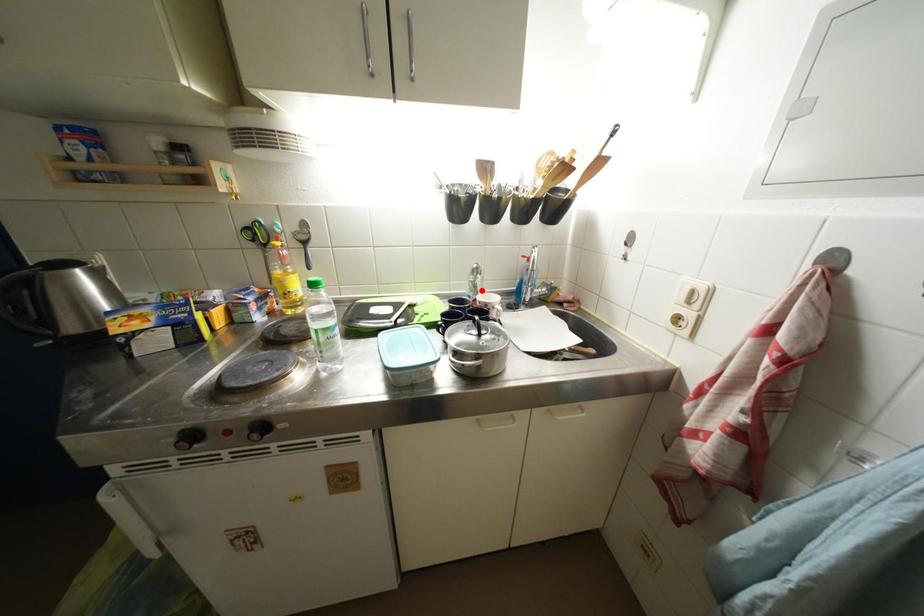
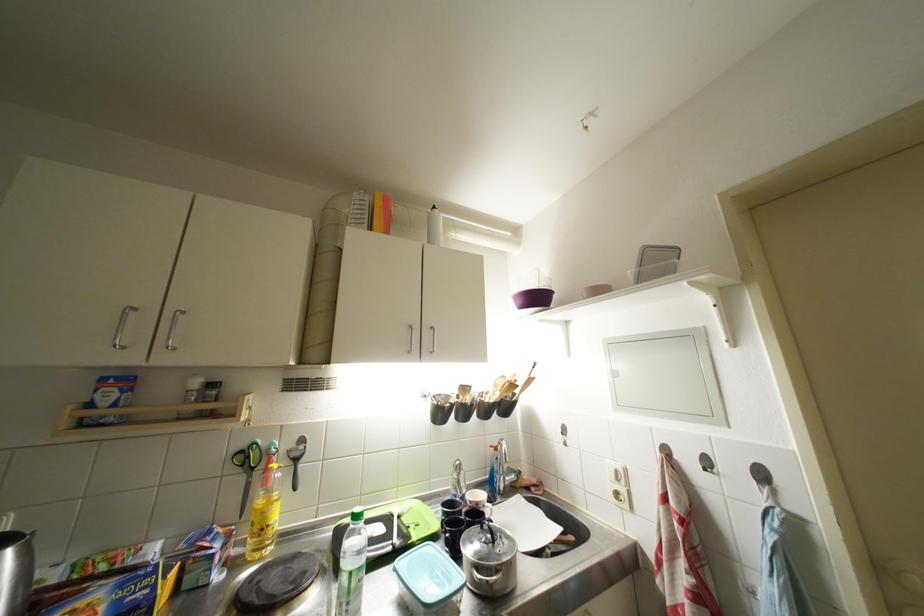
Question: I am providing you with two images of the same scene from different viewpoints. Given a red point in image1, look at the same physical point in image2. Is it:

Choices:
 (A) Closer to the viewpoint
 (B) Farther from the viewpoint

Answer: (B)